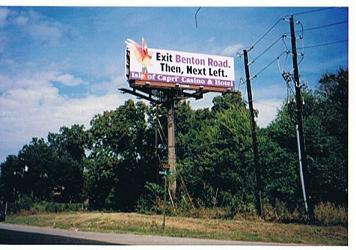
Identify the location of column. This screenshot has height=250, width=356. (173, 154).